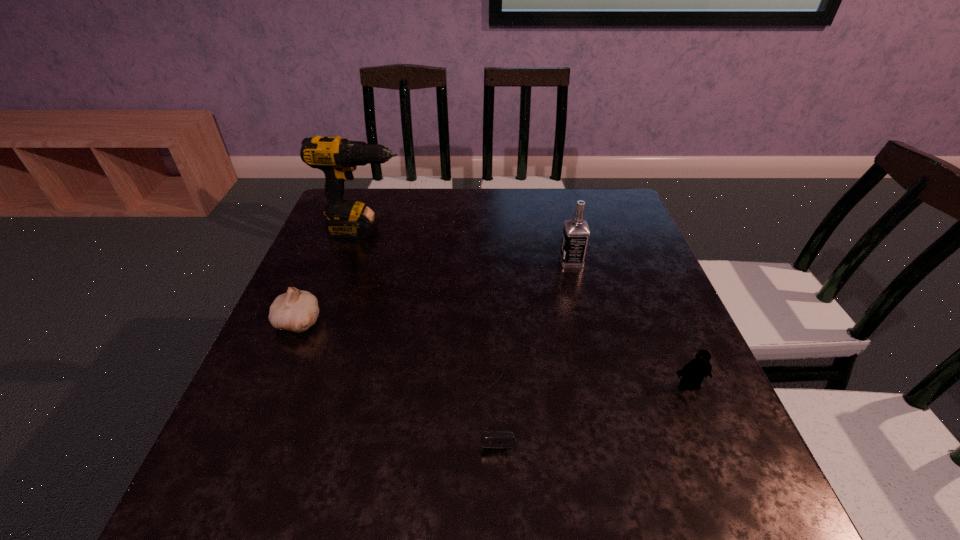
In the image, there is a desktop. Where is `free space at the far edge`? free space at the far edge is located at coordinates (502, 216).

Image resolution: width=960 pixels, height=540 pixels. In order to click on blank space at the near edge of the desktop in this screenshot , I will do `click(335, 518)`.

Locate an element on the screen. vacant space at the left edge of the desktop is located at coordinates (372, 238).

In the image, there is a desktop. At what (x,y) coordinates should I click in order to perform the action: click on free space at the right edge. Please return your answer as a coordinate pair (x, y). This screenshot has width=960, height=540. Looking at the image, I should click on (x=669, y=314).

Identify the location of blank space at the near right corner of the desktop. The height and width of the screenshot is (540, 960). (683, 487).

Locate an element on the screen. The width and height of the screenshot is (960, 540). unoccupied position between the third farthest object and the third object from left to right is located at coordinates (396, 364).

The image size is (960, 540). What are the coordinates of `empty location between the drill and the webcam` in the screenshot? It's located at (429, 319).

At what (x,y) coordinates should I click in order to perform the action: click on free spot between the rightmost object and the garlic. Please return your answer as a coordinate pair (x, y). The width and height of the screenshot is (960, 540). Looking at the image, I should click on (494, 353).

At what (x,y) coordinates should I click in order to perform the action: click on vacant area between the garlic and the tallest object. Please return your answer as a coordinate pair (x, y). Looking at the image, I should click on (332, 276).

The width and height of the screenshot is (960, 540). Identify the location of unoccupied area between the fourth shortest object and the rightmost object. [x=631, y=323].